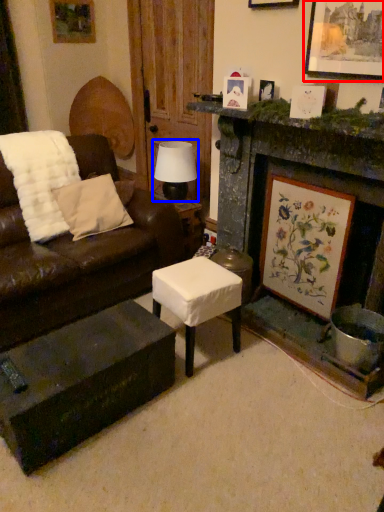
Question: Which object appears farthest to the camera in this image, picture frame (highlighted by a red box) or table lamp (highlighted by a blue box)?

Choices:
 (A) picture frame
 (B) table lamp

Answer: (B)